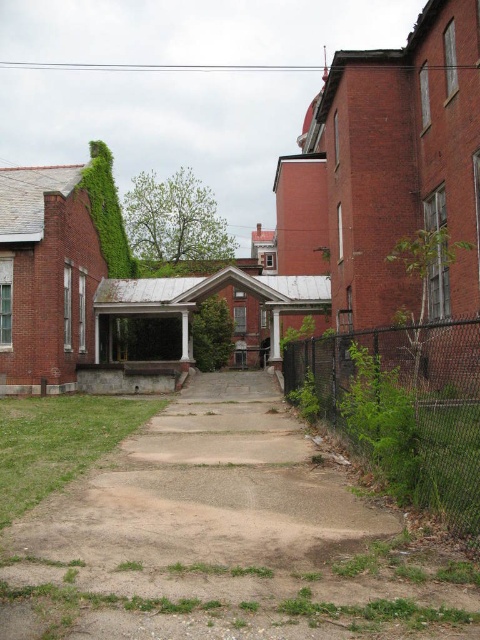
Question: Which point is farther to the camera?

Choices:
 (A) green matte ivy at center
 (B) dirt/gravel path at center
 (C) green chain-link fence at lower right

Answer: (A)

Question: Can you confirm if green chain-link fence at lower right is positioned above green leafy ivy at upper left?

Choices:
 (A) yes
 (B) no

Answer: (B)

Question: In this image, where is green chain-link fence at lower right located relative to green matte ivy at center?

Choices:
 (A) right
 (B) left

Answer: (A)

Question: Which object appears farthest from the camera in this image?

Choices:
 (A) green chain-link fence at lower right
 (B) green matte ivy at center
 (C) dirt/gravel path at center

Answer: (B)

Question: Does green chain-link fence at lower right appear over green matte ivy at center?

Choices:
 (A) no
 (B) yes

Answer: (A)

Question: Which point appears closest to the camera in this image?

Choices:
 (A) (216, 364)
 (B) (109, 260)
 (C) (123, 486)

Answer: (C)